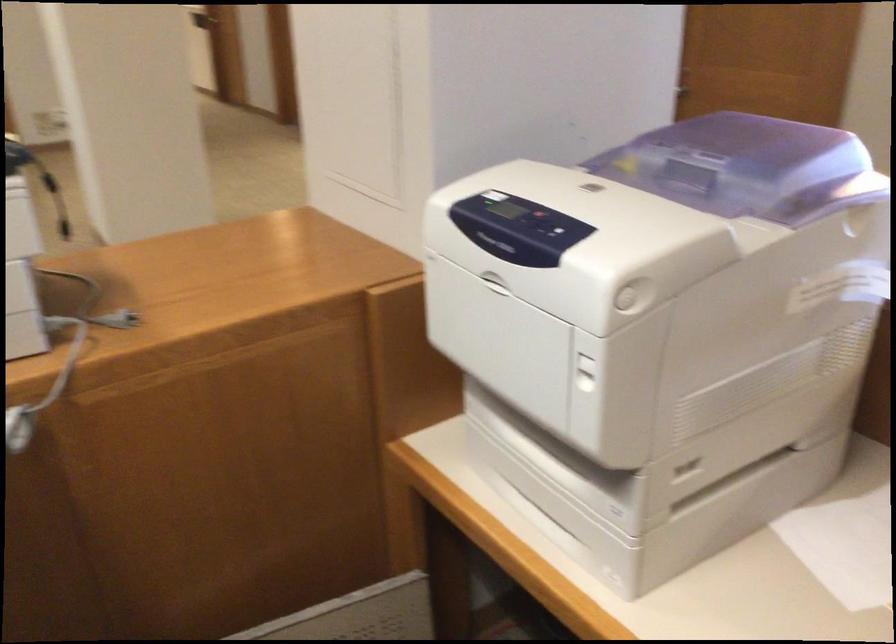
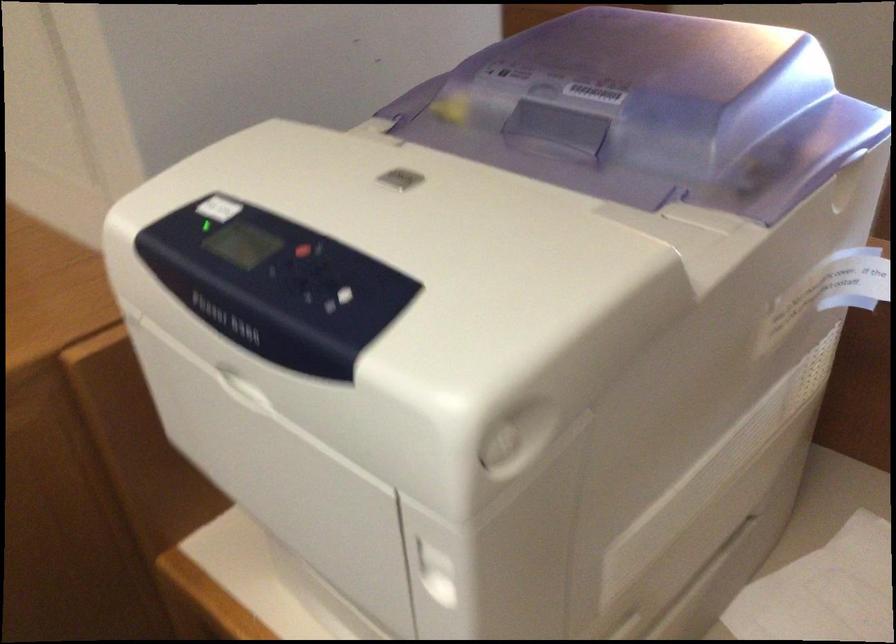
Question: Based on the continuous images, in which direction is the camera rotating? Reply with the corresponding letter.

Choices:
 (A) Left
 (B) Right
 (C) Up
 (D) Down

Answer: (B)